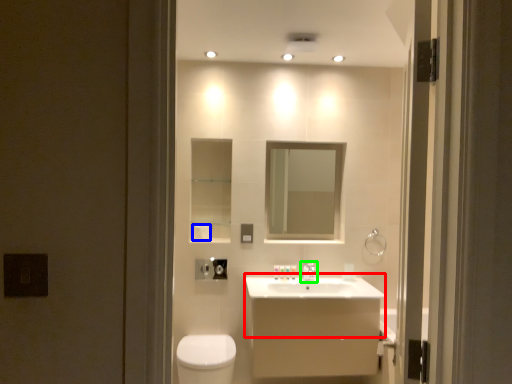
Question: Which is nearer to the counter top (highlighted by a red box)? toilet paper (highlighted by a blue box) or tap (highlighted by a green box).

Choices:
 (A) toilet paper
 (B) tap

Answer: (B)